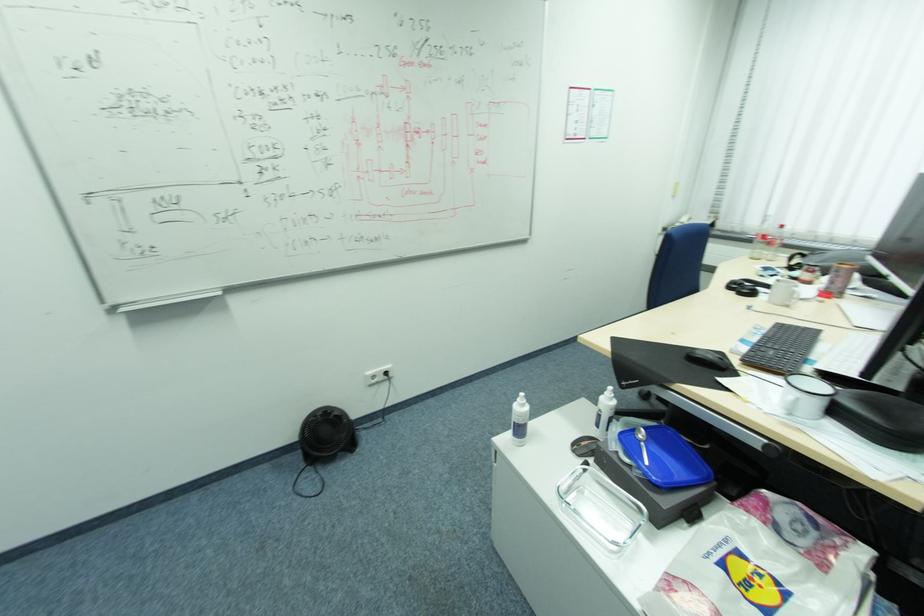
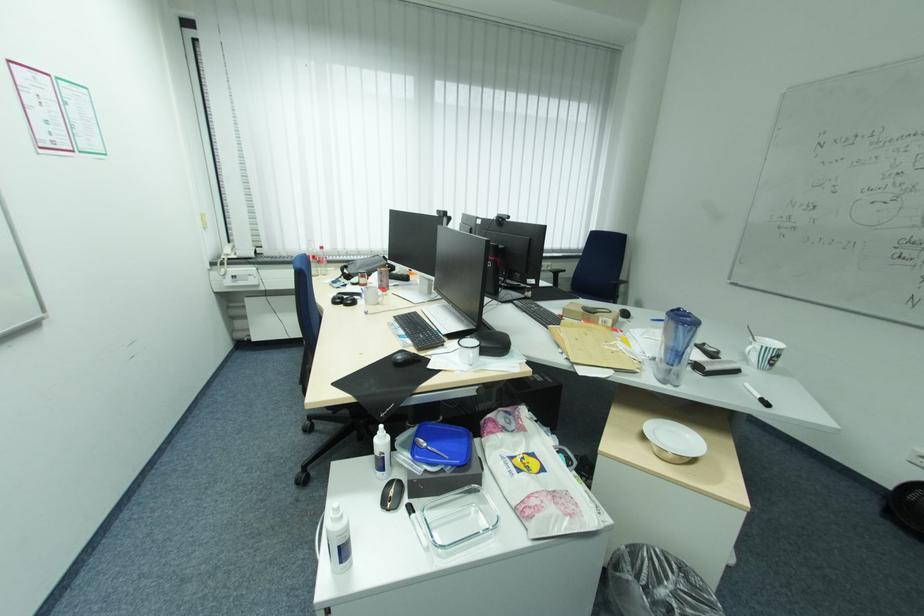
Where in the second image is the point corresponding to [581,447] from the first image?

(395, 504)